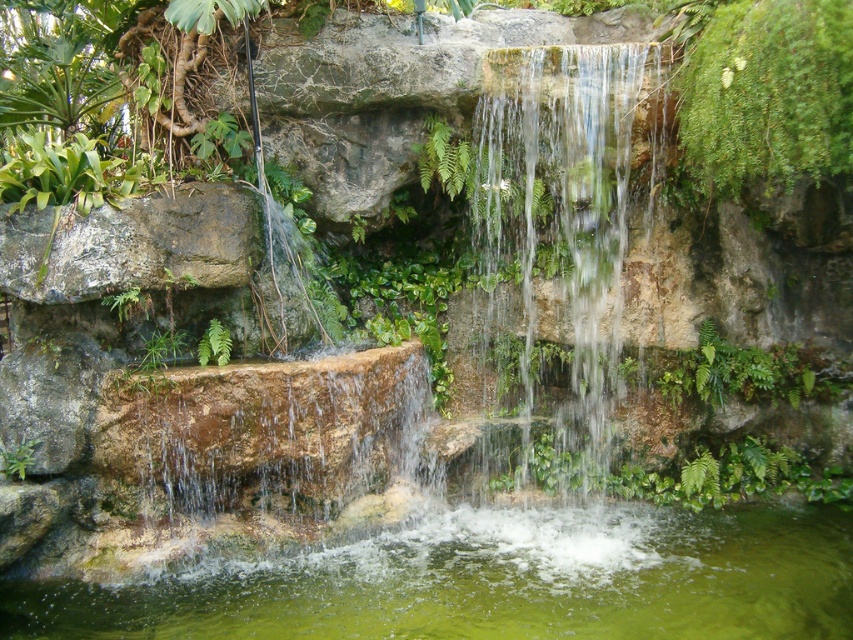
Question: Which point is closer to the camera taking this photo?

Choices:
 (A) (128, 310)
 (B) (30, 452)

Answer: (B)

Question: Which object is farther from the camera taking this photo?

Choices:
 (A) green leafy plant at center
 (B) green leafy plant at center-left
 (C) clear water at center

Answer: (C)

Question: Is clear water at center to the left of green leafy plant at center-left from the viewer's perspective?

Choices:
 (A) no
 (B) yes

Answer: (A)

Question: Can you confirm if green liquid water at bottom is positioned to the right of green leafy plant at center?

Choices:
 (A) yes
 (B) no

Answer: (A)

Question: Which point is farther from the camera taking this photo?

Choices:
 (A) (24, 445)
 (B) (602, 49)
 (C) (154, 340)

Answer: (B)

Question: Can you confirm if green leafy plant at lower left is thinner than green leafy plant at center-left?

Choices:
 (A) yes
 (B) no

Answer: (A)